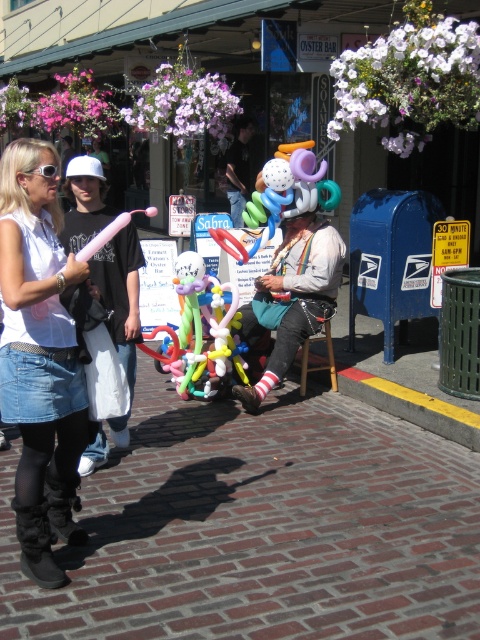
Question: Can you confirm if brick pavement at lower center is positioned above shiny black jacket at center?

Choices:
 (A) yes
 (B) no

Answer: (B)

Question: Among these points, which one is nearest to the camera?

Choices:
 (A) (164, 404)
 (B) (199, 364)
 (C) (264, 291)
 (D) (44, 173)

Answer: (D)

Question: Which point is closer to the camera?

Choices:
 (A) sunglasses at upper left
 (B) multicolored balloon sculpture at center
 (C) multicolored rubber balloon animal at center

Answer: (A)

Question: Which point appears farthest from the camera in this image?

Choices:
 (A) (230, 184)
 (B) (2, 394)
 (C) (45, 164)
 (D) (187, 376)

Answer: (A)

Question: Does multicolored balloon sculpture at center appear on the right side of shiny black jacket at center?

Choices:
 (A) yes
 (B) no

Answer: (A)

Question: Can you confirm if brick pavement at lower center is positioned below multicolored rubber balloon animal at center?

Choices:
 (A) yes
 (B) no

Answer: (A)